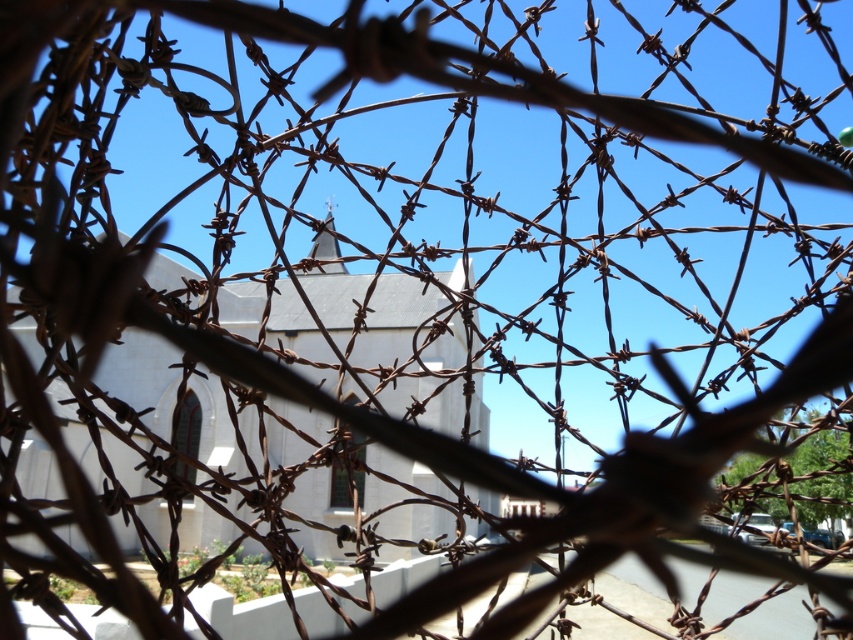
Question: Does white matte chapel at center have a lesser width compared to rusty metal spire at center?

Choices:
 (A) no
 (B) yes

Answer: (A)

Question: Which of the following is the farthest from the observer?

Choices:
 (A) white matte chapel at center
 (B) rusty metal spire at center

Answer: (B)

Question: Can you confirm if white matte chapel at center is positioned to the left of rusty metal spire at center?

Choices:
 (A) no
 (B) yes

Answer: (B)

Question: Can you confirm if white matte chapel at center is positioned to the left of rusty metal spire at center?

Choices:
 (A) no
 (B) yes

Answer: (B)